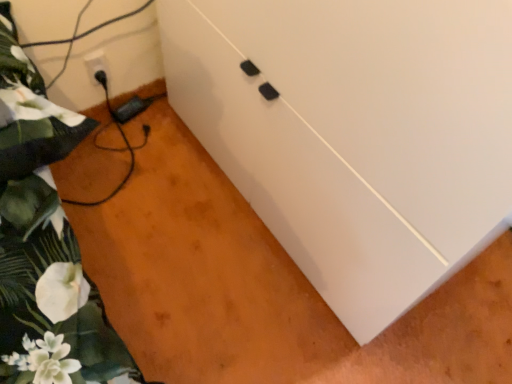
Find the location of a particular element. This screenshot has height=384, width=512. free space in front of white matte cabinet at center is located at coordinates (263, 309).